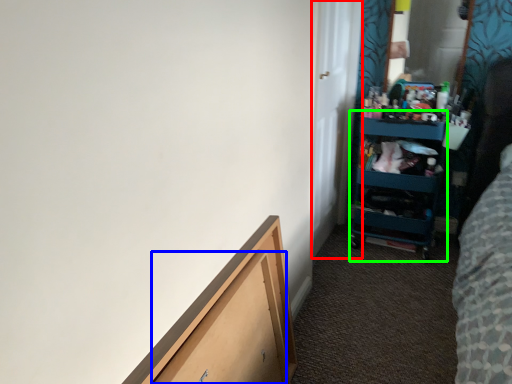
Question: Considering the real-world distances, which object is farthest from door (highlighted by a red box)? drawer (highlighted by a blue box) or cabinet (highlighted by a green box)?

Choices:
 (A) drawer
 (B) cabinet

Answer: (A)